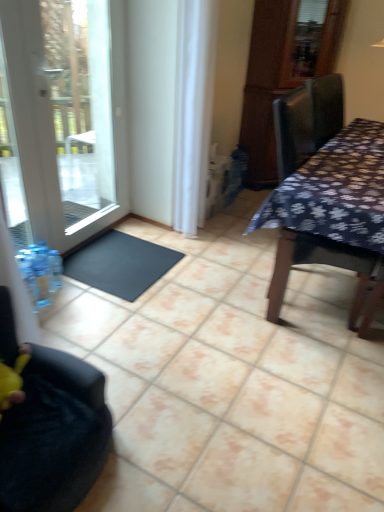
Where is `vacant space to the right of white sheer curtain at center`? This screenshot has width=384, height=512. vacant space to the right of white sheer curtain at center is located at coordinates (225, 230).